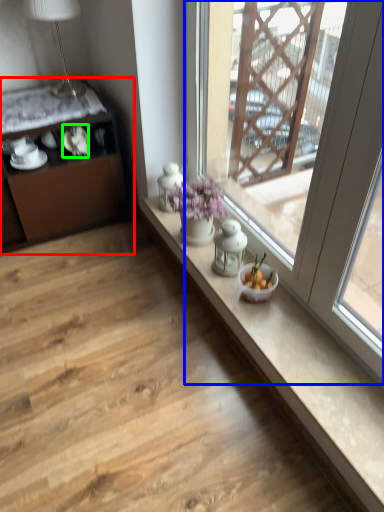
Question: Based on their relative distances, which object is farther from cabinetry (highlighted by a red box)? Choose from window (highlighted by a blue box) and tableware (highlighted by a green box).

Choices:
 (A) window
 (B) tableware

Answer: (A)